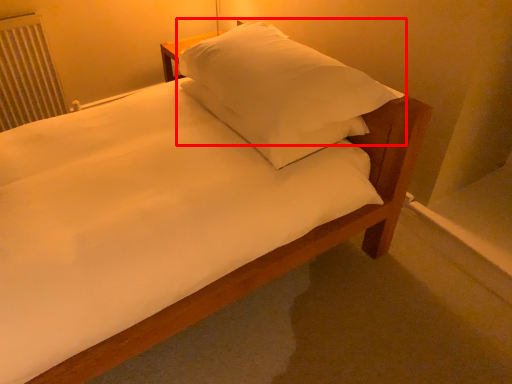
Question: Considering the relative positions of pillow (annotated by the red box) and radiator in the image provided, where is pillow (annotated by the red box) located with respect to the staircase?

Choices:
 (A) right
 (B) left

Answer: (A)